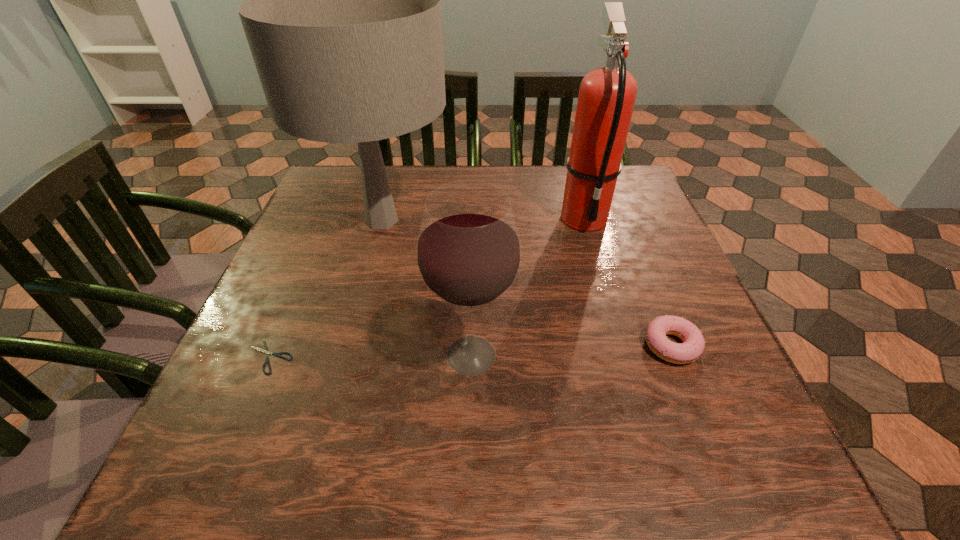
The image size is (960, 540). I want to click on free space at the left edge of the desktop, so click(284, 383).

In order to click on vacant area at the right edge of the desktop in this screenshot , I will do `click(631, 296)`.

This screenshot has width=960, height=540. I want to click on blank space at the far left corner of the desktop, so click(343, 188).

Identify the location of vacant region at the near left corner of the desktop. (204, 486).

This screenshot has width=960, height=540. In the image, there is a desktop. In order to click on vacant space at the near right corner in this screenshot , I will do `click(751, 461)`.

At what (x,y) coordinates should I click in order to perform the action: click on free space between the shortest object and the alcohol. Please return your answer as a coordinate pair (x, y). The width and height of the screenshot is (960, 540). Looking at the image, I should click on (371, 356).

Find the location of `vacant area that lies between the third shortest object and the second shortest object`. vacant area that lies between the third shortest object and the second shortest object is located at coordinates (571, 350).

The image size is (960, 540). I want to click on free spot between the doughnut and the fire extinguisher, so click(628, 281).

Find the location of a particular element. The width and height of the screenshot is (960, 540). free space that is in between the second shortest object and the alcohol is located at coordinates (571, 350).

Locate an element on the screen. The image size is (960, 540). empty space between the lampshade and the doughnut is located at coordinates (527, 283).